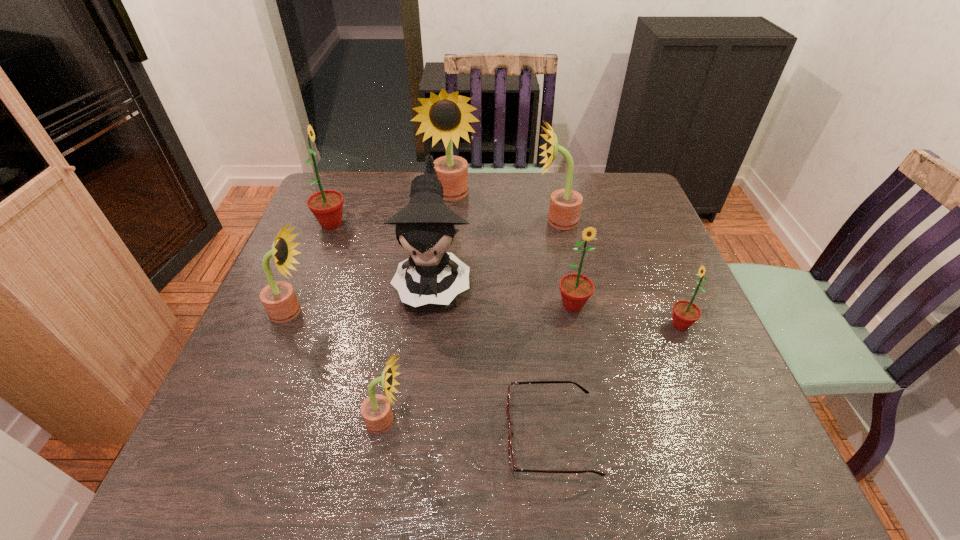
Identify which sunflower is the third nearest to the tallest object. Please provide its 2D coordinates. Your answer should be formatted as a tuple, i.e. [(x, y)], where the tuple contains the x and y coordinates of a point satisfying the conditions above.

[(576, 289)]

This screenshot has width=960, height=540. I want to click on sunflower object that ranks as the sixth closest to the biggest green sunflower, so click(685, 313).

At what (x,y) coordinates should I click in order to perform the action: click on the second closest yellow sunflower to the doll. Please return your answer as a coordinate pair (x, y). This screenshot has height=540, width=960. Looking at the image, I should click on click(x=278, y=298).

Locate which yellow sunflower ranks third in proximity to the biggest yellow sunflower. Please provide its 2D coordinates. Your answer should be formatted as a tuple, i.e. [(x, y)], where the tuple contains the x and y coordinates of a point satisfying the conditions above.

[(376, 411)]

The height and width of the screenshot is (540, 960). Identify the location of green sunflower that can be found as the second closest to the doll. (576, 289).

Where is `the closest green sunflower relative to the second biggest green sunflower`? the closest green sunflower relative to the second biggest green sunflower is located at coordinates (685, 313).

Where is `vacant area that satisfies the following two spatial constraints: 1. on the face of the second smallest green sunflower; 2. on the lenses of the spectacles`? This screenshot has height=540, width=960. vacant area that satisfies the following two spatial constraints: 1. on the face of the second smallest green sunflower; 2. on the lenses of the spectacles is located at coordinates (599, 435).

Locate an element on the screen. This screenshot has height=540, width=960. free spot that satisfies the following two spatial constraints: 1. on the face of the second biggest green sunflower; 2. on the lenses of the red spectacles is located at coordinates (599, 435).

This screenshot has height=540, width=960. Find the location of `vacant space that satisfies the following two spatial constraints: 1. on the face of the second green sunflower from left to right; 2. on the face of the nearest yellow sunflower`. vacant space that satisfies the following two spatial constraints: 1. on the face of the second green sunflower from left to right; 2. on the face of the nearest yellow sunflower is located at coordinates (596, 421).

Locate an element on the screen. vacant space that satisfies the following two spatial constraints: 1. on the face of the second biggest green sunflower; 2. on the lenses of the spectacles is located at coordinates (x=599, y=435).